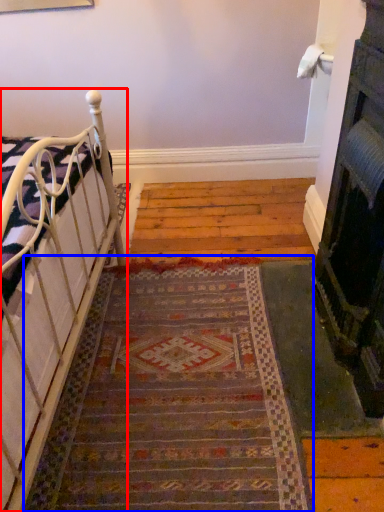
Question: Which point is closer to the camera, furniture (highlighted by a red box) or doormat (highlighted by a blue box)?

Choices:
 (A) furniture
 (B) doormat

Answer: (A)